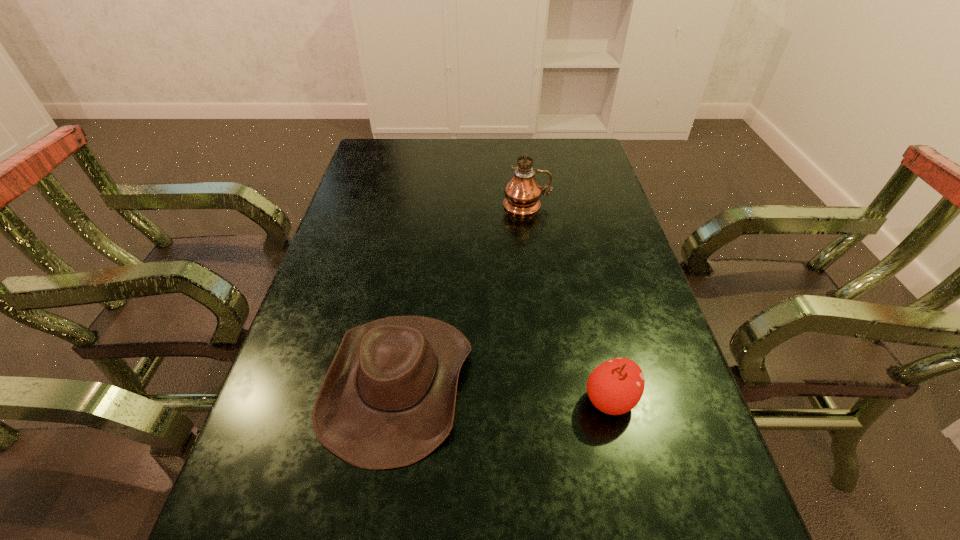
The image size is (960, 540). What are the coordinates of `object that is the second closest one to the leftmost object` in the screenshot? It's located at (522, 192).

I want to click on free point that satisfies the following two spatial constraints: 1. on the front side of the oil lamp; 2. on the left side of the apple, so click(554, 400).